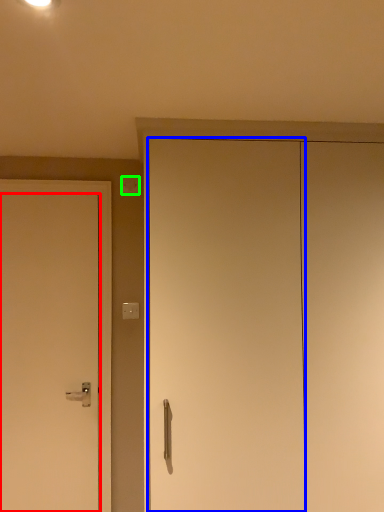
Question: Which is farther away from door (highlighted by a red box)? door (highlighted by a blue box) or light switch (highlighted by a green box)?

Choices:
 (A) door
 (B) light switch

Answer: (B)